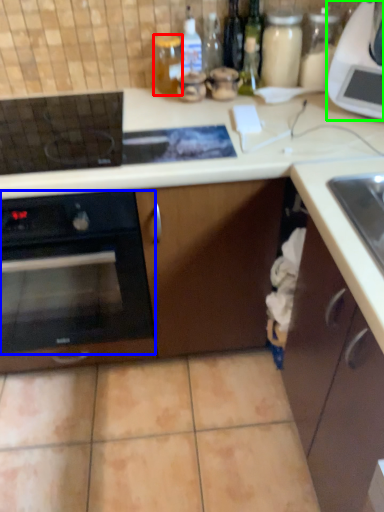
Question: Estimate the real-world distances between objects in this image. Which object is closer to bottle (highlighted by a red box), oven (highlighted by a blue box) or kitchen appliance (highlighted by a green box)?

Choices:
 (A) oven
 (B) kitchen appliance

Answer: (B)